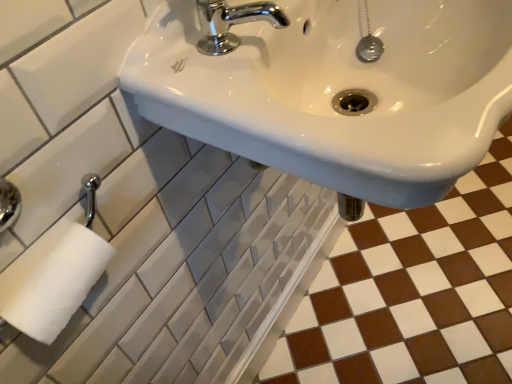
The width and height of the screenshot is (512, 384). I want to click on vacant space in front of chrome/metallic faucet at upper center, so click(294, 105).